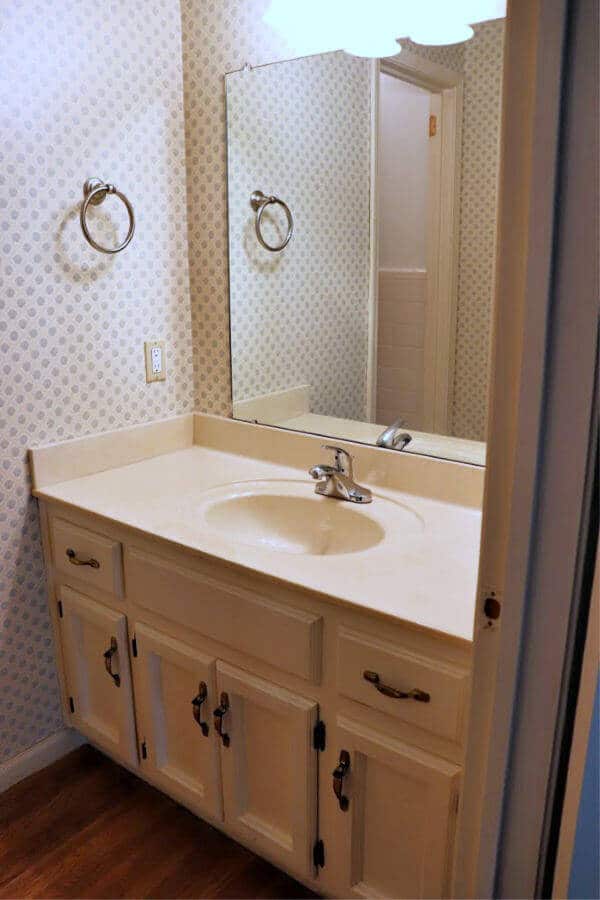
This screenshot has height=900, width=600. I want to click on wallpaper, so click(36, 693).